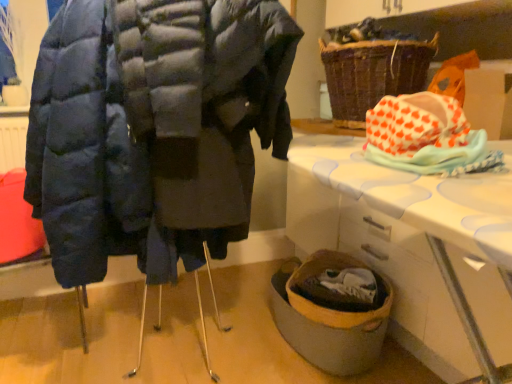
The image size is (512, 384). I want to click on brown woven basket at upper right, so click(x=372, y=73).

The image size is (512, 384). What are the coordinates of `white plastic table at lower right` in the screenshot? It's located at (401, 247).

Measure the distance between orange heart-patterned fabric at upper right and camera.

The distance of orange heart-patterned fabric at upper right from camera is 32.36 inches.

The image size is (512, 384). Find the location of `matte blue puffer coat at left`. matte blue puffer coat at left is located at coordinates (153, 129).

Is brown woven basket at upper right directly adjacent to matte blue puffer coat at left?

They are not placed beside each other.

Who is smaller, brown woven basket at upper right or matte blue puffer coat at left?

brown woven basket at upper right is smaller.

Is brown woven basket at upper right positioned with its back to matte blue puffer coat at left?

No.

From the image's perspective, who appears lower, brown woven basket at upper right or white plastic table at lower right?

white plastic table at lower right appears lower in the image.

Is brown woven basket at upper right far away from white plastic table at lower right?

Actually, brown woven basket at upper right and white plastic table at lower right are a little close together.

Find the location of a particular element. This screenshot has width=512, height=384. table that is in front of the brown woven basket at upper right is located at coordinates (401, 247).

Can white plastic table at lower right be found inside brown woven basket at upper right?

No, white plastic table at lower right is not surrounded by brown woven basket at upper right.

Which object is positioned more to the left, orange heart-patterned fabric at upper right or matte blue puffer coat at left?

matte blue puffer coat at left is more to the left.

Is orange heart-patterned fabric at upper right wider or thinner than matte blue puffer coat at left?

In the image, orange heart-patterned fabric at upper right appears to be more narrow than matte blue puffer coat at left.

Are orange heart-patterned fabric at upper right and matte blue puffer coat at left far apart?

No, orange heart-patterned fabric at upper right is not far away from matte blue puffer coat at left.

Which of these two, matte blue puffer coat at left or orange heart-patterned fabric at upper right, is smaller?

orange heart-patterned fabric at upper right is smaller.

Can you tell me how much matte blue puffer coat at left and orange heart-patterned fabric at upper right differ in facing direction?

86 degrees separate the facing orientations of matte blue puffer coat at left and orange heart-patterned fabric at upper right.

In the scene shown: Considering the relative sizes of matte blue puffer coat at left and orange heart-patterned fabric at upper right in the image provided, is matte blue puffer coat at left taller than orange heart-patterned fabric at upper right?

Yes, matte blue puffer coat at left is taller than orange heart-patterned fabric at upper right.

Is matte blue puffer coat at left aimed at orange heart-patterned fabric at upper right?

Yes, matte blue puffer coat at left is oriented towards orange heart-patterned fabric at upper right.

Which is in front, point (387, 101) or point (367, 45)?

The point (387, 101) is more forward.

Visually, is orange heart-patterned fabric at upper right positioned to the left or to the right of brown woven basket at upper right?

Clearly, orange heart-patterned fabric at upper right is on the left of brown woven basket at upper right in the image.

Does orange heart-patterned fabric at upper right touch brown woven basket at upper right?

No, orange heart-patterned fabric at upper right is not making contact with brown woven basket at upper right.

From a real-world perspective, is orange heart-patterned fabric at upper right physically located above or below brown woven basket at upper right?

orange heart-patterned fabric at upper right is situated lower than brown woven basket at upper right in the real world.

Is the surface of orange heart-patterned fabric at upper right in direct contact with white plastic table at lower right?

orange heart-patterned fabric at upper right is not next to white plastic table at lower right, and they're not touching.

Can we say orange heart-patterned fabric at upper right lies outside white plastic table at lower right?

orange heart-patterned fabric at upper right lies outside white plastic table at lower right's area.

Which object is thinner, orange heart-patterned fabric at upper right or white plastic table at lower right?

orange heart-patterned fabric at upper right.

How distant is orange heart-patterned fabric at upper right from white plastic table at lower right?

orange heart-patterned fabric at upper right and white plastic table at lower right are 24.96 inches apart from each other.

Which object is further away from the camera, matte blue puffer coat at left or white plastic table at lower right?

white plastic table at lower right is further from the camera.

Does matte blue puffer coat at left appear on the right side of white plastic table at lower right?

No.

Find the location of `coat above the white plastic table at lower right (from a real-world perspective)`. coat above the white plastic table at lower right (from a real-world perspective) is located at coordinates (153, 129).

Where is `basket that is above the matte blue puffer coat at left (from a real-world perspective)`? The image size is (512, 384). basket that is above the matte blue puffer coat at left (from a real-world perspective) is located at coordinates (372, 73).

Locate an element on the screen. This screenshot has height=384, width=512. table beneath the brown woven basket at upper right (from a real-world perspective) is located at coordinates (401, 247).

From the image, which object appears to be nearer to matte blue puffer coat at left, orange heart-patterned fabric at upper right or white plastic table at lower right?

The object closer to matte blue puffer coat at left is orange heart-patterned fabric at upper right.

Estimate the real-world distances between objects in this image. Which object is further from matte blue puffer coat at left, brown woven basket at upper right or white plastic table at lower right?

white plastic table at lower right is further to matte blue puffer coat at left.

Looking at the image, which one is located closer to orange heart-patterned fabric at upper right, matte blue puffer coat at left or white plastic table at lower right?

white plastic table at lower right lies closer to orange heart-patterned fabric at upper right than the other object.

Estimate the real-world distances between objects in this image. Which object is further from white plastic table at lower right, brown woven basket at upper right or matte blue puffer coat at left?

The object further to white plastic table at lower right is matte blue puffer coat at left.

Looking at the image, which one is located closer to brown woven basket at upper right, white plastic table at lower right or matte blue puffer coat at left?

Among the two, white plastic table at lower right is located nearer to brown woven basket at upper right.

Based on their spatial positions, is orange heart-patterned fabric at upper right or brown woven basket at upper right closer to matte blue puffer coat at left?

orange heart-patterned fabric at upper right lies closer to matte blue puffer coat at left than the other object.

Consider the image. Based on their spatial positions, is white plastic table at lower right or matte blue puffer coat at left further from orange heart-patterned fabric at upper right?

matte blue puffer coat at left is positioned further to the anchor orange heart-patterned fabric at upper right.

Consider the image. Considering their positions, is brown woven basket at upper right positioned closer to orange heart-patterned fabric at upper right than white plastic table at lower right?

white plastic table at lower right.

The height and width of the screenshot is (384, 512). Identify the location of material between matte blue puffer coat at left and white plastic table at lower right in the horizontal direction. (426, 137).

At what (x,y) coordinates should I click in order to perform the action: click on basket between matte blue puffer coat at left and white plastic table at lower right in the horizontal direction. Please return your answer as a coordinate pair (x, y). The width and height of the screenshot is (512, 384). Looking at the image, I should click on (372, 73).

In order to click on table between orange heart-patterned fabric at upper right and brown woven basket at upper right in the front-back direction in this screenshot , I will do `click(401, 247)`.

Find the location of a particular element. The image size is (512, 384). material located between matte blue puffer coat at left and brown woven basket at upper right in the left-right direction is located at coordinates (426, 137).